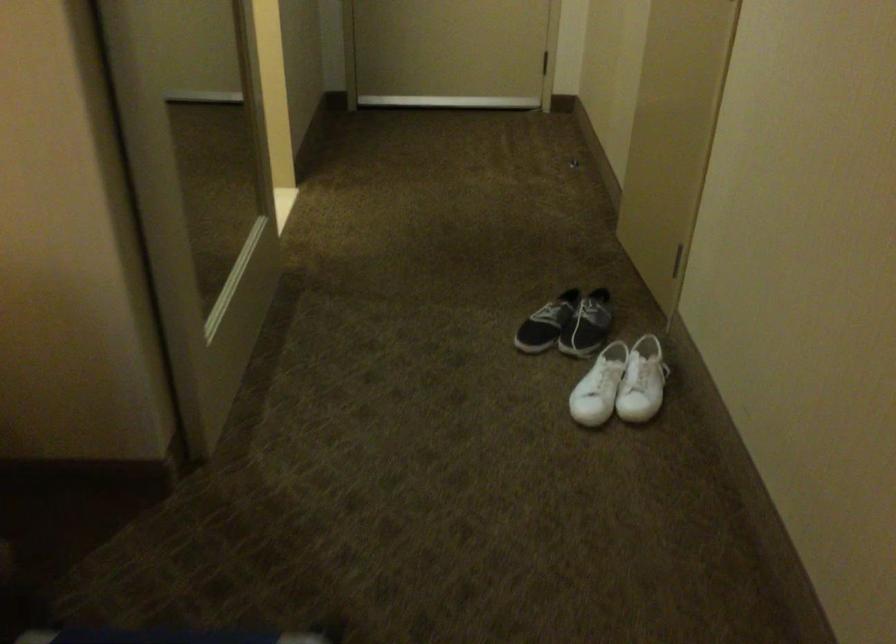
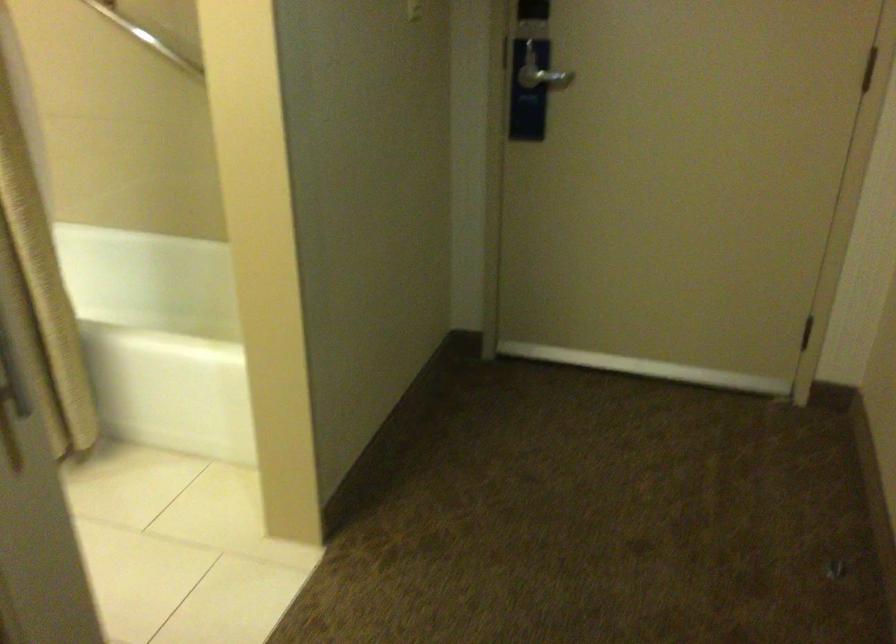
Question: Which direction would the cameraman need to move to produce the second image? Reply with the corresponding letter.

Choices:
 (A) Left
 (B) Right
 (C) Forward
 (D) Backward

Answer: (C)